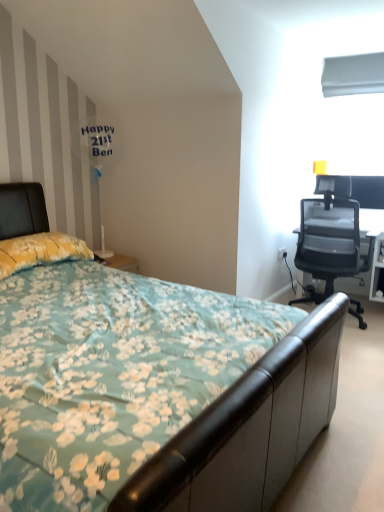
This screenshot has height=512, width=384. What do you see at coordinates (155, 391) in the screenshot?
I see `floral fabric bed at center` at bounding box center [155, 391].

Find the location of a particular element. white glossy table lamp at upper left is located at coordinates [97, 142].

Locate an element on the screen. This screenshot has height=512, width=384. yellow floral fabric pillow at left is located at coordinates (40, 251).

How many degrees apart are the facing directions of white smooth plastic at upper right and transparent mesh office chair at right?

The angle between the facing direction of white smooth plastic at upper right and the facing direction of transparent mesh office chair at right is 179 degrees.

Are white smooth plastic at upper right and transparent mesh office chair at right making contact?

white smooth plastic at upper right and transparent mesh office chair at right are clearly separated.

Consider the image. Is white smooth plastic at upper right looking in the opposite direction of transparent mesh office chair at right?

white smooth plastic at upper right is not turned away from transparent mesh office chair at right.

In order to click on window screen above the transparent mesh office chair at right (from the image's perspective) in this screenshot , I will do `click(353, 75)`.

Which of these two, floral fabric bed at center or yellow floral fabric pillow at left, stands taller?

With more height is floral fabric bed at center.

Is floral fabric bed at center to the left or to the right of yellow floral fabric pillow at left in the image?

floral fabric bed at center is positioned on yellow floral fabric pillow at left's right side.

Is floral fabric bed at center positioned far away from yellow floral fabric pillow at left?

No, floral fabric bed at center is not far away from yellow floral fabric pillow at left.

Who is bigger, floral fabric bed at center or transparent mesh office chair at right?

floral fabric bed at center is bigger.

In the scene shown: Is floral fabric bed at center aimed at transparent mesh office chair at right?

No.

Which object is wider, floral fabric bed at center or transparent mesh office chair at right?

Wider between the two is floral fabric bed at center.

From a real-world perspective, does floral fabric bed at center stand above transparent mesh office chair at right?

Actually, floral fabric bed at center is physically below transparent mesh office chair at right in the real world.

Considering the sizes of objects floral fabric bed at center and white glossy table lamp at upper left in the image provided, who is wider, floral fabric bed at center or white glossy table lamp at upper left?

floral fabric bed at center is wider.

What's the angular difference between floral fabric bed at center and white glossy table lamp at upper left's facing directions?

They differ by 1.05 degrees in their facing directions.

Can you confirm if floral fabric bed at center is bigger than white glossy table lamp at upper left?

Indeed, floral fabric bed at center has a larger size compared to white glossy table lamp at upper left.

Who is shorter, floral fabric bed at center or white glossy table lamp at upper left?

With less height is white glossy table lamp at upper left.

Based on the photo, between transparent mesh office chair at right and white glossy table lamp at upper left, which one appears on the left side from the viewer's perspective?

From the viewer's perspective, white glossy table lamp at upper left appears more on the left side.

Is transparent mesh office chair at right inside or outside of white glossy table lamp at upper left?

transparent mesh office chair at right exists outside the volume of white glossy table lamp at upper left.

Image resolution: width=384 pixels, height=512 pixels. In the image, there is a transparent mesh office chair at right. Identify the location of table lamp above it (from the image's perspective). (97, 142).

From the picture: Which of these two, transparent mesh office chair at right or white glossy table lamp at upper left, stands shorter?

white glossy table lamp at upper left is shorter.

Is white glossy table lamp at upper left positioned with its back to yellow floral fabric pillow at left?

white glossy table lamp at upper left does not have its back to yellow floral fabric pillow at left.

Would you say white glossy table lamp at upper left contains yellow floral fabric pillow at left?

No, yellow floral fabric pillow at left is not a part of white glossy table lamp at upper left.

Is the position of white glossy table lamp at upper left less distant than that of yellow floral fabric pillow at left?

No, the depth of white glossy table lamp at upper left is greater than that of yellow floral fabric pillow at left.

From a real-world perspective, is white glossy table lamp at upper left beneath yellow floral fabric pillow at left?

No, from a real-world perspective, white glossy table lamp at upper left is not under yellow floral fabric pillow at left.

Are transparent mesh office chair at right and yellow floral fabric pillow at left beside each other?

No, transparent mesh office chair at right is not next to yellow floral fabric pillow at left.

Is transparent mesh office chair at right wider or thinner than yellow floral fabric pillow at left?

Clearly, transparent mesh office chair at right has more width compared to yellow floral fabric pillow at left.

Which object is positioned more to the right, transparent mesh office chair at right or yellow floral fabric pillow at left?

From the viewer's perspective, transparent mesh office chair at right appears more on the right side.

What's the angular difference between transparent mesh office chair at right and yellow floral fabric pillow at left's facing directions?

The angular difference between transparent mesh office chair at right and yellow floral fabric pillow at left is 89.1 degrees.

You are a GUI agent. You are given a task and a screenshot of the screen. Output one action in this format:
    pyautogui.click(x=<x>, y=<y>)
    Task: Click on the chair lying in front of the white smooth plastic at upper right
    Image resolution: width=384 pixels, height=512 pixels.
    Given the screenshot: What is the action you would take?
    pyautogui.click(x=335, y=230)

What are the coordinates of `pillow on the left side of floral fabric bed at center` in the screenshot? It's located at (40, 251).

Which object lies further to the anchor point white smooth plastic at upper right, white plastic power outlet at right or yellow floral fabric pillow at left?

yellow floral fabric pillow at left is further to white smooth plastic at upper right.

Based on their spatial positions, is white glossy table lamp at upper left or floral fabric bed at center closer to white smooth plastic at upper right?

white glossy table lamp at upper left.

Consider the image. When comparing their distances from white smooth plastic at upper right, does white plastic power outlet at right or floral fabric bed at center seem closer?

Among the two, white plastic power outlet at right is located nearer to white smooth plastic at upper right.

Estimate the real-world distances between objects in this image. Which object is further from transparent mesh office chair at right, yellow floral fabric pillow at left or white plastic power outlet at right?

Among the two, yellow floral fabric pillow at left is located further to transparent mesh office chair at right.

Which object lies nearer to the anchor point transparent mesh office chair at right, yellow floral fabric pillow at left or white smooth plastic at upper right?

white smooth plastic at upper right.

When comparing their distances from transparent mesh office chair at right, does white smooth plastic at upper right or yellow floral fabric pillow at left seem further?

Among the two, yellow floral fabric pillow at left is located further to transparent mesh office chair at right.

When comparing their distances from white glossy table lamp at upper left, does yellow floral fabric pillow at left or transparent mesh office chair at right seem closer?

The object closer to white glossy table lamp at upper left is yellow floral fabric pillow at left.

From the image, which object appears to be farther from yellow floral fabric pillow at left, transparent mesh office chair at right or white plastic power outlet at right?

white plastic power outlet at right is further to yellow floral fabric pillow at left.

Where is `pillow between floral fabric bed at center and white smooth plastic at upper right along the z-axis`? pillow between floral fabric bed at center and white smooth plastic at upper right along the z-axis is located at coordinates (40, 251).

Where is `chair between floral fabric bed at center and white smooth plastic at upper right in the front-back direction`? This screenshot has width=384, height=512. chair between floral fabric bed at center and white smooth plastic at upper right in the front-back direction is located at coordinates (335, 230).

You are a GUI agent. You are given a task and a screenshot of the screen. Output one action in this format:
    pyautogui.click(x=<x>, y=<y>)
    Task: Click on the chair between floral fabric bed at center and white plastic power outlet at right along the z-axis
    This screenshot has width=384, height=512.
    Given the screenshot: What is the action you would take?
    pyautogui.click(x=335, y=230)

Image resolution: width=384 pixels, height=512 pixels. I want to click on power outlet between white glossy table lamp at upper left and transparent mesh office chair at right from left to right, so click(282, 253).